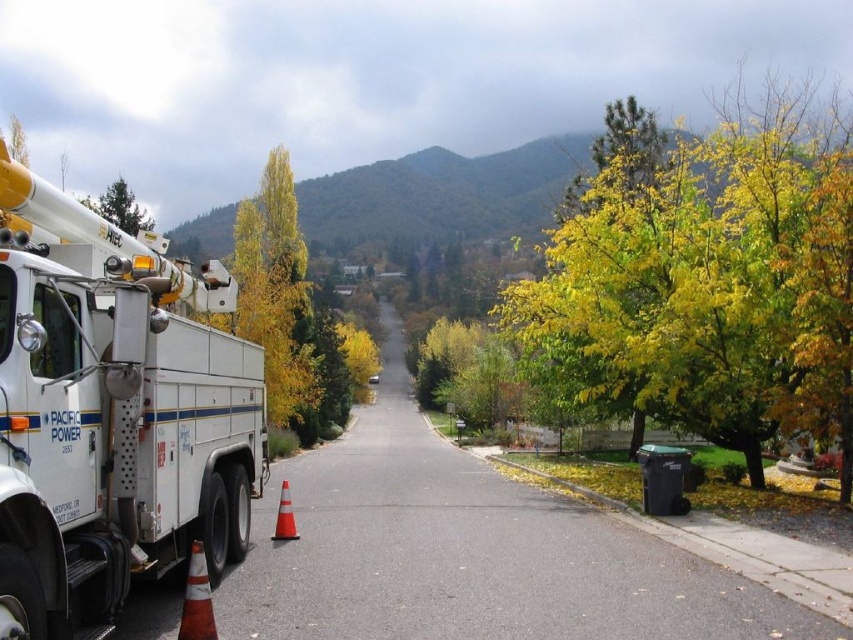
Question: Can you confirm if white metallic utility truck at left is positioned to the right of yellow/golden leaves at upper right?

Choices:
 (A) yes
 (B) no

Answer: (B)

Question: Is the position of white metallic utility truck at left less distant than that of yellow/golden leaves at upper right?

Choices:
 (A) yes
 (B) no

Answer: (A)

Question: Which point appears farthest from the camera in this image?

Choices:
 (A) (82, 198)
 (B) (57, 499)
 (C) (781, 128)
 (D) (200, 550)

Answer: (A)

Question: In this image, where is yellow/golden leaves at upper right located relative to orange reflective cone at center?

Choices:
 (A) above
 (B) below

Answer: (A)

Question: Among these points, which one is farthest from the camera?

Choices:
 (A) (195, 556)
 (B) (131, 234)

Answer: (B)

Question: Which object is farther from the camera taking this photo?

Choices:
 (A) white metallic utility truck at left
 (B) green leafy tree at upper left
 (C) orange reflective cone at center
 (D) yellow/golden leaves at upper right

Answer: (B)